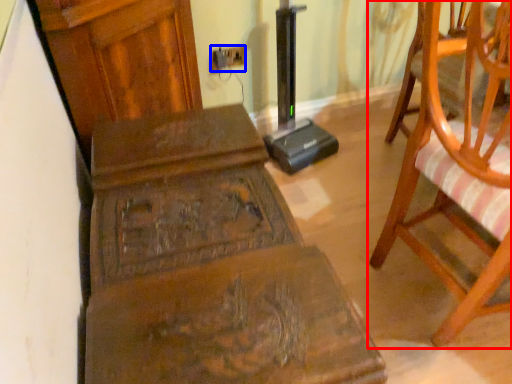
Question: Which object appears farthest to the camera in this image, chair (highlighted by a red box) or electric outlet (highlighted by a blue box)?

Choices:
 (A) chair
 (B) electric outlet

Answer: (B)